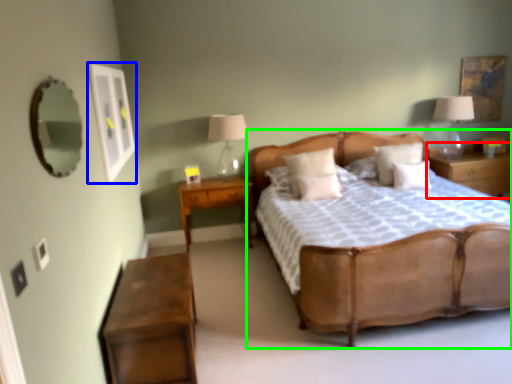
Question: Which object is the closest to the nightstand (highlighted by a red box)? Choose among these: picture frame (highlighted by a blue box) or bed (highlighted by a green box).

Choices:
 (A) picture frame
 (B) bed

Answer: (B)